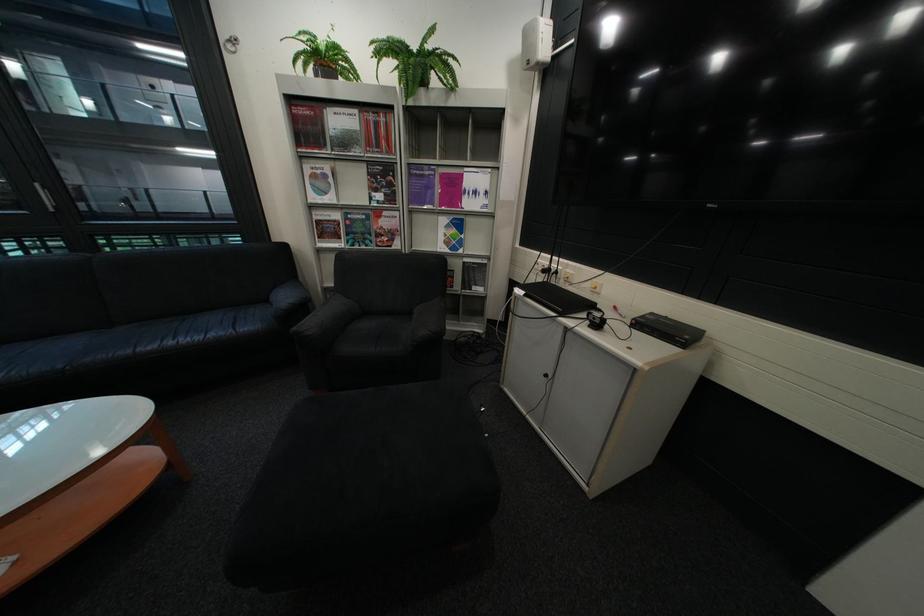
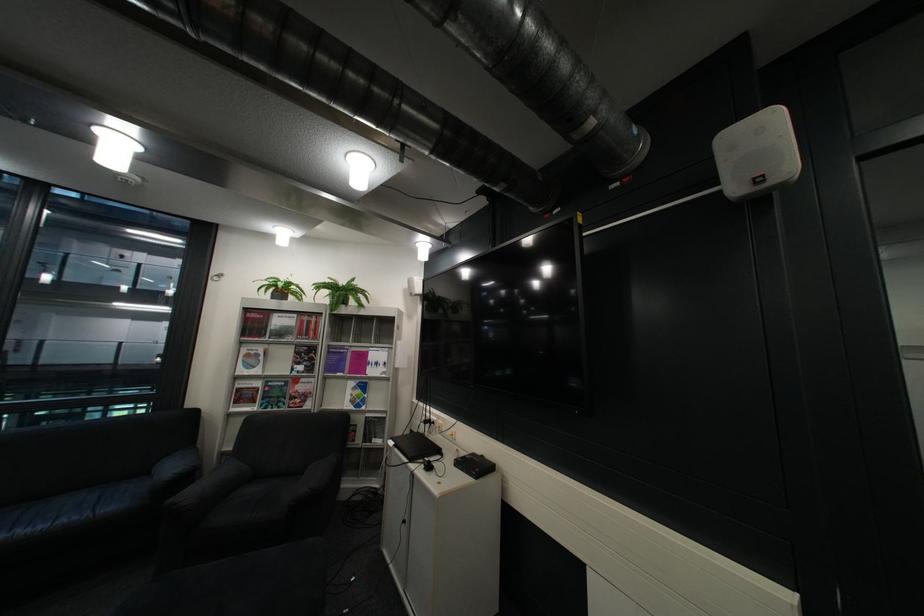
The point at (493, 290) is marked in the first image. Where is the corresponding point in the second image?

(393, 442)